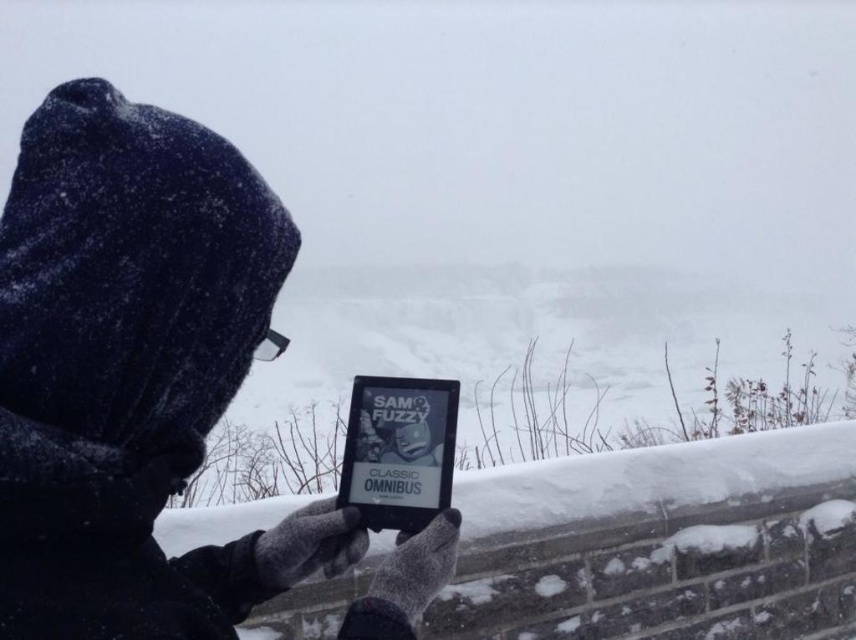
Question: Which of the following is the closest to the observer?

Choices:
 (A) black matte tablet at center
 (B) black fabric hood at upper left

Answer: (B)

Question: Which point is farther to the camera?

Choices:
 (A) (390, 380)
 (B) (3, 444)

Answer: (A)

Question: Is black fabric hood at upper left smaller than black matte tablet at center?

Choices:
 (A) yes
 (B) no

Answer: (B)

Question: Can you confirm if black fabric hood at upper left is wider than black matte tablet at center?

Choices:
 (A) no
 (B) yes

Answer: (B)

Question: Does black fabric hood at upper left appear on the left side of black matte tablet at center?

Choices:
 (A) yes
 (B) no

Answer: (A)